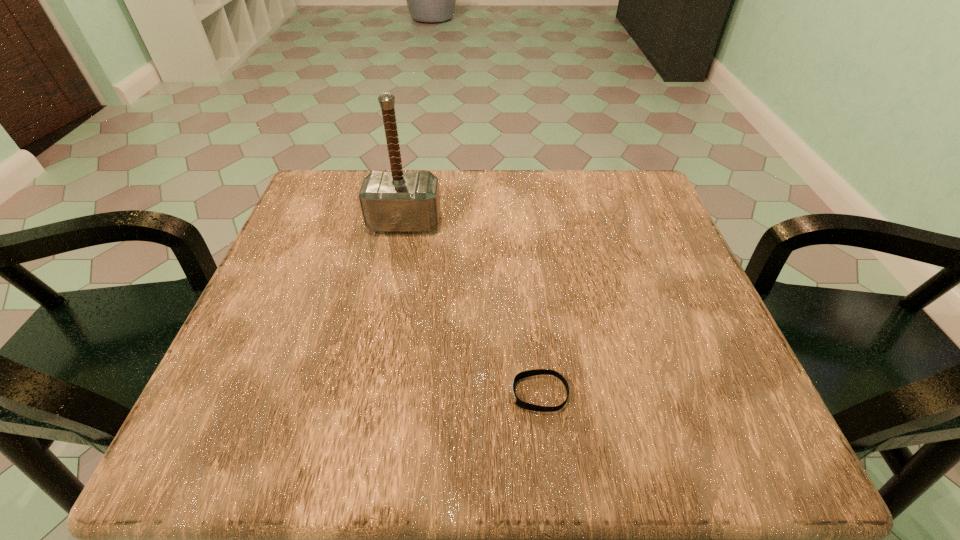
Locate an element on the screen. The image size is (960, 540). free point at the far edge is located at coordinates (561, 214).

This screenshot has height=540, width=960. Identify the location of free space at the near edge. (571, 440).

You are a GUI agent. You are given a task and a screenshot of the screen. Output one action in this format:
    pyautogui.click(x=<x>, y=<y>)
    Task: Click on the free location at the left edge
    The image size is (960, 540).
    Given the screenshot: What is the action you would take?
    pyautogui.click(x=286, y=393)

In the image, there is a desktop. Where is `free space at the right edge`? The height and width of the screenshot is (540, 960). free space at the right edge is located at coordinates (669, 353).

Identify the location of vacant space at the near left corner. click(257, 417).

The width and height of the screenshot is (960, 540). I want to click on free space at the far right corner of the desktop, so click(632, 186).

In the image, there is a desktop. Identify the location of vacant region at the near right corner. (748, 417).